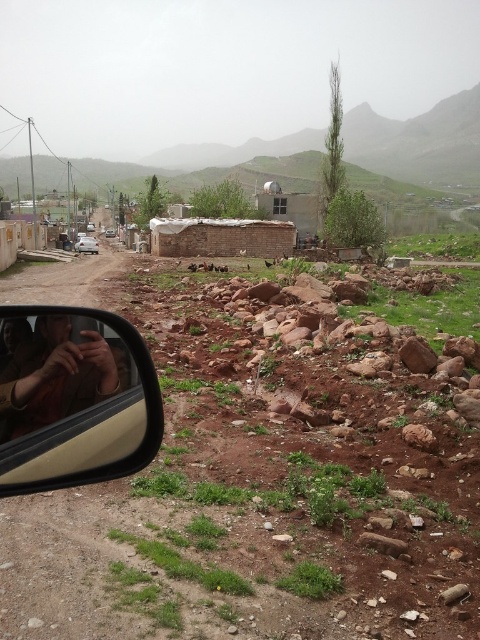
You are a photographer trying to capture a wide shot of the rural landscape. You notice the brown leather jacket at left and the silver metallic car at left are blocking part of the view. Which object should you move to free up more space in your composition?

The brown leather jacket at left is thinner than the silver metallic car at left, so moving the brown leather jacket at left would free up more space since it takes up less width.

You are a passenger in a car and want to take a photo of the landscape outside. You notice the matte beige rearview mirror at lower left and the brown leather jacket at left. Which object is closer to the bottom edge of the car window?

The matte beige rearview mirror at lower left is closer to the bottom edge of the car window because it is located below the brown leather jacket at left.